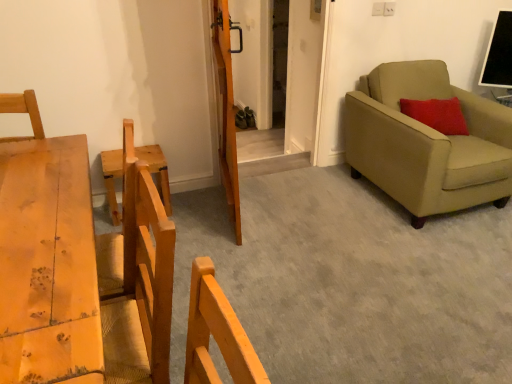
Question: Can you confirm if wooden barn door at center is bigger than light brown wooden table at left?

Choices:
 (A) yes
 (B) no

Answer: (A)

Question: Could you tell me if wooden barn door at center is facing light brown wooden table at left?

Choices:
 (A) yes
 (B) no

Answer: (B)

Question: Considering the relative sizes of wooden barn door at center and light brown wooden table at left in the image provided, is wooden barn door at center shorter than light brown wooden table at left?

Choices:
 (A) yes
 (B) no

Answer: (B)

Question: Would you consider wooden barn door at center to be distant from light brown wooden table at left?

Choices:
 (A) no
 (B) yes

Answer: (B)

Question: Is wooden barn door at center turned away from light brown wooden table at left?

Choices:
 (A) no
 (B) yes

Answer: (A)

Question: From the image's perspective, relative to light brown wooden table at left, is beige fabric armchair at right above or below?

Choices:
 (A) above
 (B) below

Answer: (A)

Question: From a real-world perspective, is beige fabric armchair at right above or below light brown wooden table at left?

Choices:
 (A) above
 (B) below

Answer: (B)

Question: Looking at their shapes, would you say beige fabric armchair at right is wider or thinner than light brown wooden table at left?

Choices:
 (A) wide
 (B) thin

Answer: (A)

Question: Considering their positions, is beige fabric armchair at right located in front of or behind light brown wooden table at left?

Choices:
 (A) behind
 (B) front

Answer: (A)

Question: From a real-world perspective, is wooden door at center physically located above or below light brown wooden table at left?

Choices:
 (A) above
 (B) below

Answer: (A)

Question: Would you say wooden door at center is to the left or to the right of light brown wooden table at left in the picture?

Choices:
 (A) left
 (B) right

Answer: (B)

Question: Is wooden door at center in front of or behind light brown wooden table at left in the image?

Choices:
 (A) front
 (B) behind

Answer: (B)

Question: Is wooden door at center spatially inside light brown wooden table at left, or outside of it?

Choices:
 (A) inside
 (B) outside

Answer: (B)

Question: Relative to light brown wooden table at left, is wooden chair at left in front or behind?

Choices:
 (A) behind
 (B) front

Answer: (A)

Question: From a real-world perspective, is wooden chair at left positioned above or below light brown wooden table at left?

Choices:
 (A) above
 (B) below

Answer: (B)